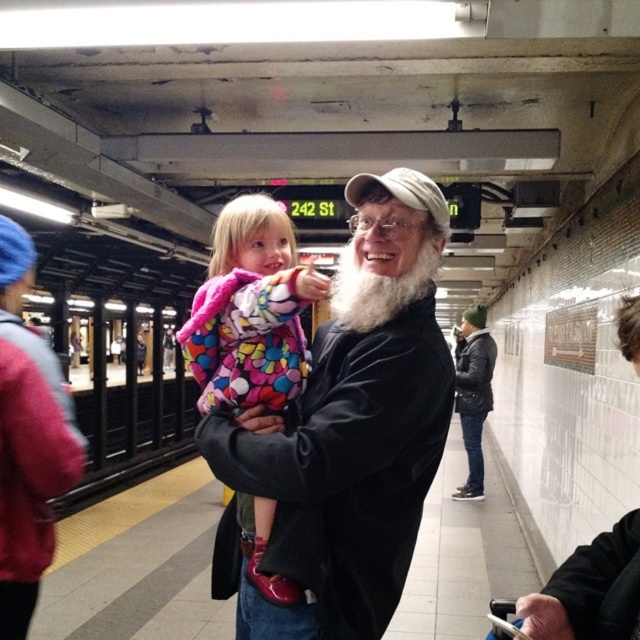
You are standing at the entrance of the subway station and want to locate the whitewoollybeard at center. According to the coordinates provided, where should you look to find him?

The whitewoollybeard at center is located at the coordinates point (378, 289), so you should look towards the center of the image to find him.

You are a photographer trying to capture a photo of the white matte santa claus at right and the whitewoollybeard at center. You want to ensure both subjects are in focus. Given that your camera can only focus on objects within a 1.5 meter width, will you be able to fit both subjects into the frame?

The white matte santa claus at right has a larger width than the whitewoollybeard at center. Since the camera can focus on objects within a 1.5 meter width, you need to check the combined width of both subjects. However, the exact total width isn not provided, so it depends on whether their combined width stays within the 1.5 meter limit.

You are a photographer standing at the subway station. You want to take a photo of the white matte santa claus at right and the whitewoollybeard at center. The minimum distance required for your camera to focus clearly is 24 inches. Will both subjects be in focus if you position yourself exactly between them?

The white matte santa claus at right is 24.45 inches from the whitewoollybeard at center. Since the distance between them is slightly more than 24 inches, positioning yourself exactly between them would mean each subject is just over 12 inches away from the camera. This distance is within the camera focus range, so both subjects will be in focus.